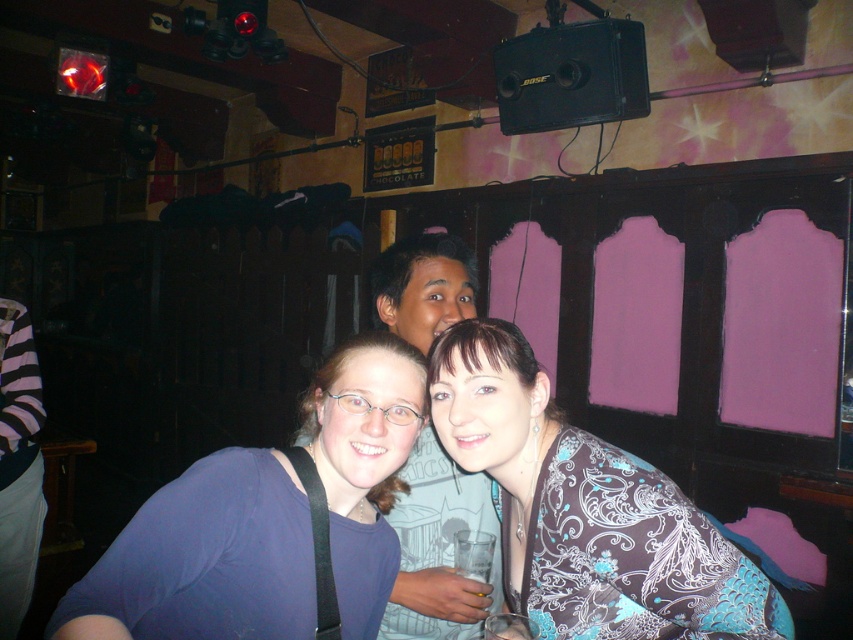
Question: Is patterned fabric dress at center positioned before matte gray t-shirt at center?

Choices:
 (A) no
 (B) yes

Answer: (B)

Question: Is blue fabric shirt at center to the right of patterned fabric dress at center from the viewer's perspective?

Choices:
 (A) no
 (B) yes

Answer: (A)

Question: Which point is farther to the camera?

Choices:
 (A) (392, 572)
 (B) (473, 397)

Answer: (A)

Question: Among these objects, which one is nearest to the camera?

Choices:
 (A) patterned fabric dress at center
 (B) matte gray t-shirt at center

Answer: (A)

Question: Among these objects, which one is farthest from the camera?

Choices:
 (A) matte gray t-shirt at center
 (B) blue fabric shirt at center
 (C) patterned fabric dress at center

Answer: (A)

Question: Is blue fabric shirt at center further to camera compared to matte gray t-shirt at center?

Choices:
 (A) yes
 (B) no

Answer: (B)